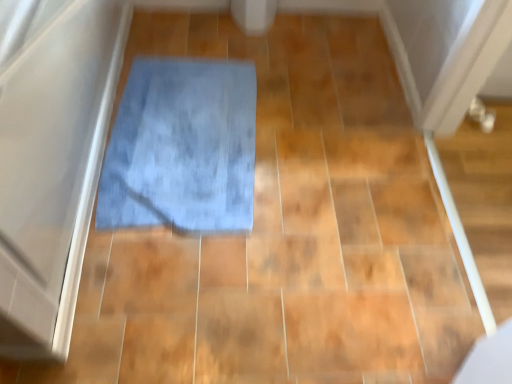
Question: From the image's perspective, is transparent plastic screen door at left over blue soft bath mat at center?

Choices:
 (A) yes
 (B) no

Answer: (A)

Question: Is transparent plastic screen door at left closer to camera compared to blue soft bath mat at center?

Choices:
 (A) no
 (B) yes

Answer: (B)

Question: Is transparent plastic screen door at left smaller than blue soft bath mat at center?

Choices:
 (A) yes
 (B) no

Answer: (B)

Question: Is transparent plastic screen door at left next to blue soft bath mat at center?

Choices:
 (A) yes
 (B) no

Answer: (B)

Question: Is transparent plastic screen door at left to the left of blue soft bath mat at center from the viewer's perspective?

Choices:
 (A) no
 (B) yes

Answer: (B)

Question: Would you consider transparent plastic screen door at left to be distant from blue soft bath mat at center?

Choices:
 (A) yes
 (B) no

Answer: (B)

Question: From the image's perspective, does blue soft bath mat at center appear lower than transparent plastic screen door at left?

Choices:
 (A) yes
 (B) no

Answer: (A)

Question: From the image's perspective, is blue soft bath mat at center over transparent plastic screen door at left?

Choices:
 (A) yes
 (B) no

Answer: (B)

Question: Is blue soft bath mat at center to the left of transparent plastic screen door at left from the viewer's perspective?

Choices:
 (A) no
 (B) yes

Answer: (A)

Question: Is blue soft bath mat at center not close to transparent plastic screen door at left?

Choices:
 (A) yes
 (B) no

Answer: (B)

Question: Is blue soft bath mat at center closer to camera compared to transparent plastic screen door at left?

Choices:
 (A) no
 (B) yes

Answer: (A)

Question: From a real-world perspective, is blue soft bath mat at center below transparent plastic screen door at left?

Choices:
 (A) no
 (B) yes

Answer: (B)

Question: Is blue soft bath mat at center in front of or behind transparent plastic screen door at left in the image?

Choices:
 (A) behind
 (B) front

Answer: (A)